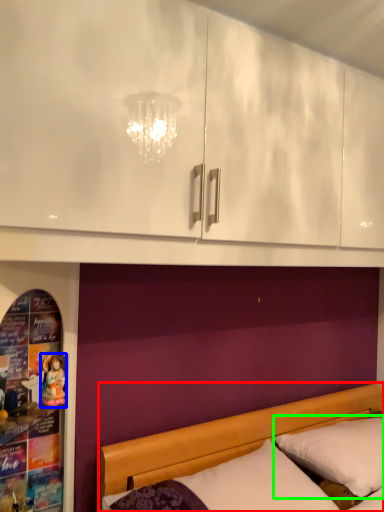
Question: Which object is positioned farthest from bed (highlighted by a red box)? Select from doll (highlighted by a blue box) and pillow (highlighted by a green box).

Choices:
 (A) doll
 (B) pillow

Answer: (A)